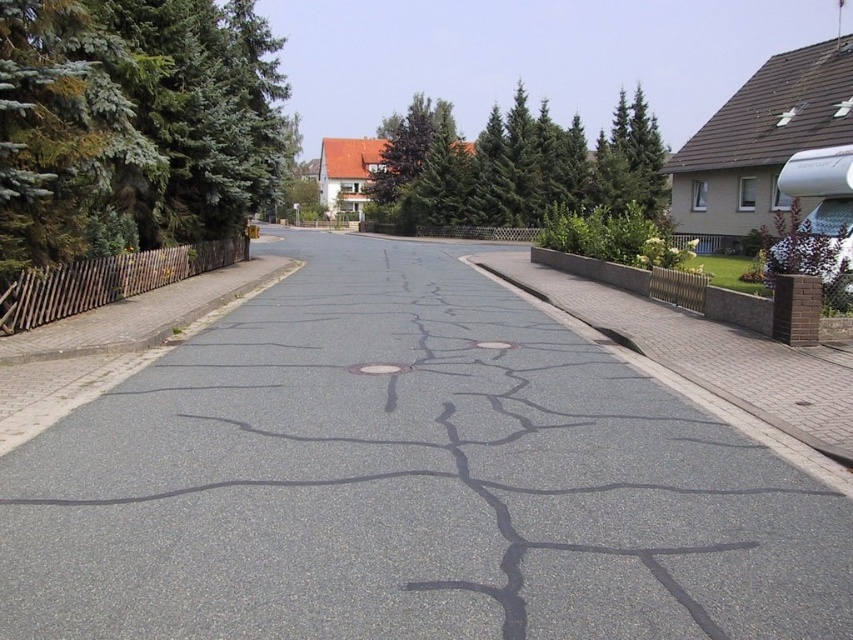
Question: Does gray asphalt road at center have a greater width compared to brick at right?

Choices:
 (A) yes
 (B) no

Answer: (A)

Question: Estimate the real-world distances between objects in this image. Which object is closer to the gray asphalt road at center?

Choices:
 (A) green textured tree at upper center
 (B) brick at right
 (C) green textured pine tree at left

Answer: (B)

Question: Which of the following is the closest to the observer?

Choices:
 (A) (415, 214)
 (B) (836, 580)

Answer: (B)

Question: Does green textured pine tree at left have a lesser width compared to brick at right?

Choices:
 (A) yes
 (B) no

Answer: (A)

Question: Is brick at right smaller than green textured tree at upper center?

Choices:
 (A) no
 (B) yes

Answer: (B)

Question: Which of these objects is positioned closest to the gray asphalt road at center?

Choices:
 (A) brick at right
 (B) green textured tree at upper center
 (C) green textured pine tree at left

Answer: (A)